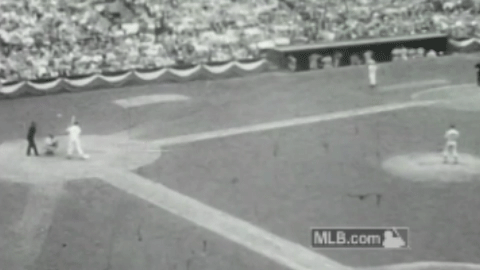
The width and height of the screenshot is (480, 270). I want to click on pitcher, so click(437, 143).